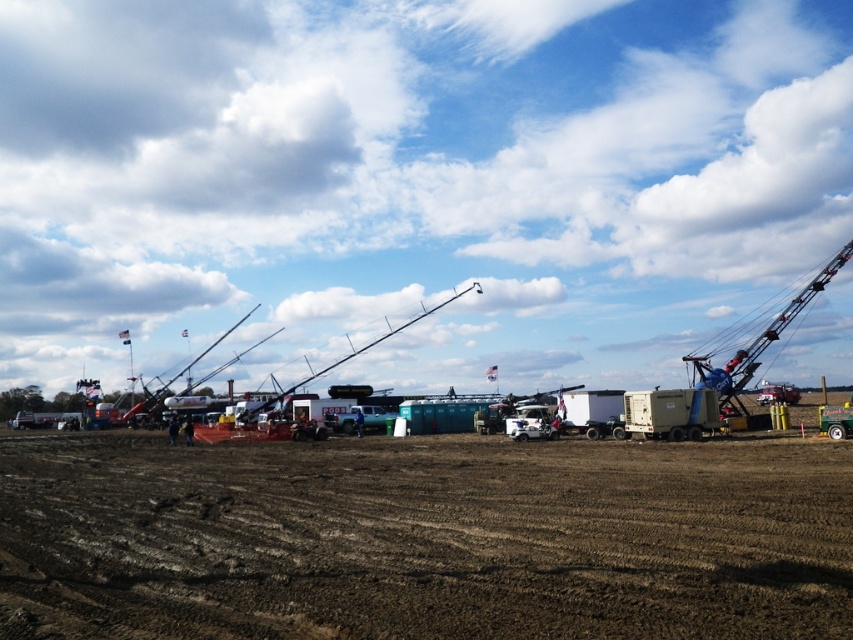
Question: Observing the image, what is the correct spatial positioning of brown soil at center in reference to blue metallic crane at right?

Choices:
 (A) above
 (B) below

Answer: (B)

Question: Which object is the closest to the blue metallic crane at right?

Choices:
 (A) beige rubber trailer truck at center right
 (B) brown soil at center

Answer: (A)

Question: Which point is farther to the camera?

Choices:
 (A) beige rubber trailer truck at center right
 (B) brown soil at center

Answer: (A)

Question: Can you confirm if blue metallic crane at right is positioned above beige rubber trailer truck at center right?

Choices:
 (A) no
 (B) yes

Answer: (B)

Question: Which point is closer to the camera?

Choices:
 (A) blue metallic crane at right
 (B) beige rubber trailer truck at center right
 (C) brown soil at center

Answer: (C)

Question: Does brown soil at center appear over beige rubber trailer truck at center right?

Choices:
 (A) yes
 (B) no

Answer: (A)